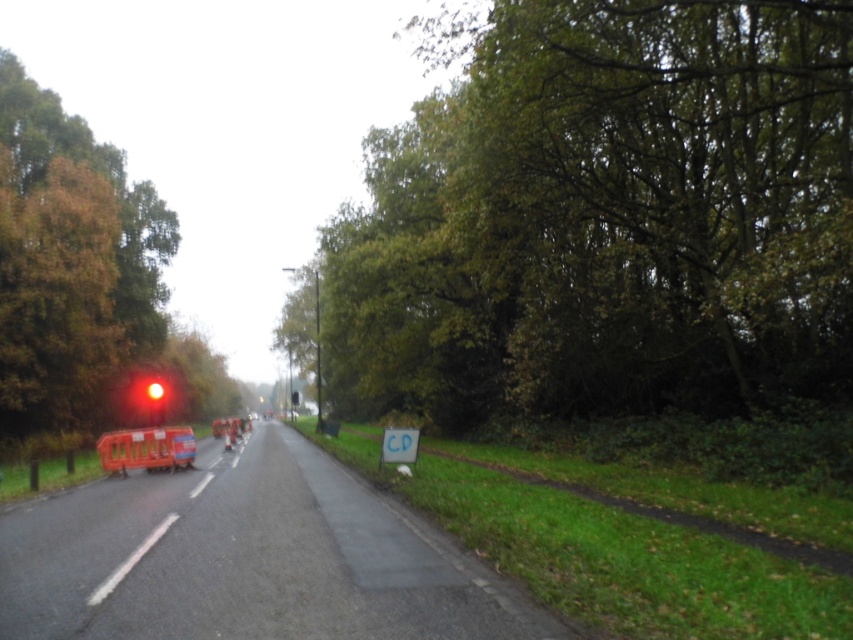
Where is the brown leafy tree at left located in the image?

The brown leafy tree at left is located at point (70, 264) in the image.